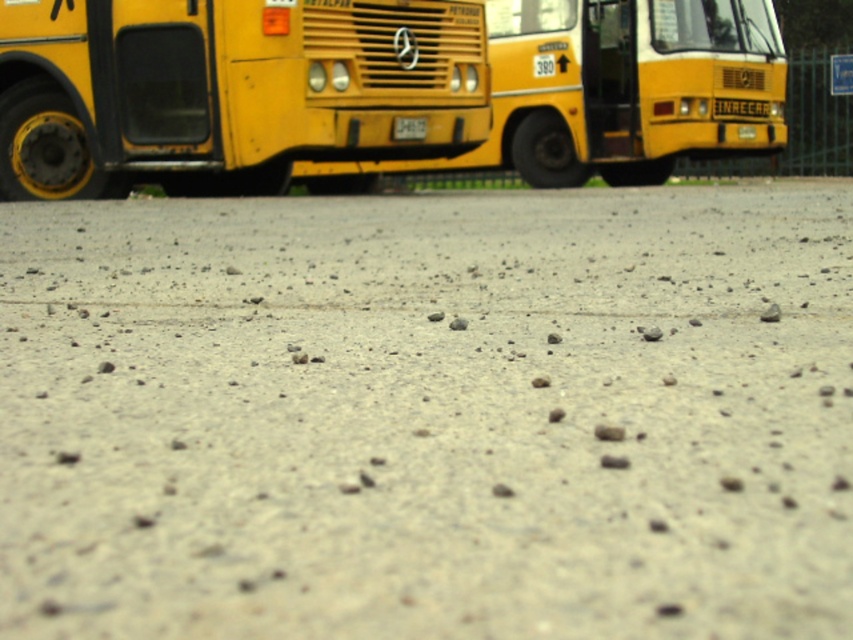
You are a delivery person trying to park your van between the two buses. The metallic yellow bus at left and the yellow matte bus at center are parked side by side. Based on their positions, which bus should you position your van closer to in order to fit between them?

The metallic yellow bus at left is located below the yellow matte bus at center, so positioning the van closer to the metallic yellow bus at left would allow it to fit between them since it is lower and there might be more space underneath or alongside.

Consider the image. You are a delivery person trying to park your van between the metallic yellow bus at left and the yellow matte bus at center in the parking lot. Based on the scene description, can your van fit vertically between them if your van is 2 meters tall?

The metallic yellow bus at left is not as tall as the yellow matte bus at center. Since the height of the metallic yellow bus at left is lower, the space between them might be sufficient for a 2 meter tall van, but exact dimensions aren

You are a delivery person with a cart that is 2 meters wide. You need to move from the right side of the metallic yellow bus at left to the left side of the yellow matte bus at center. Is there enough space for your cart to pass between them?

The distance between the metallic yellow bus at left and yellow matte bus at center is 3.07 meters. Since your cart is 2 meters wide, there is sufficient space for it to pass between them.